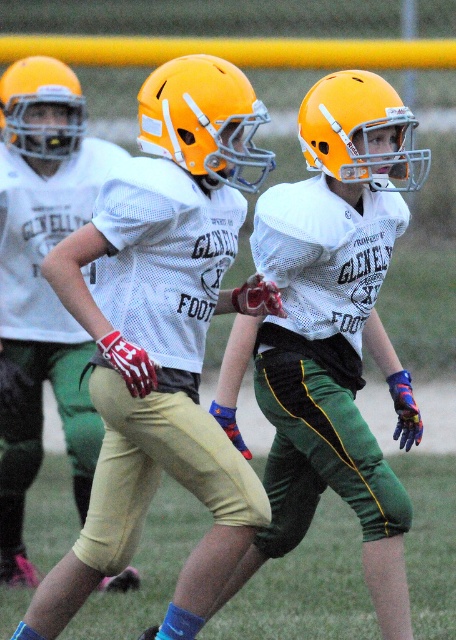
Is point (36, 323) positioned before point (326, 109)?

No, (36, 323) is further to viewer.

The width and height of the screenshot is (456, 640). Find the location of `matte white jersey at center`. matte white jersey at center is located at coordinates (41, 285).

Identify the location of matte white jersey at center. This screenshot has width=456, height=640. (41, 285).

Can you confirm if matte yellow helmet at center is positioned to the left of matte yellow helmet at upper left?

No, matte yellow helmet at center is not to the left of matte yellow helmet at upper left.

Does matte yellow helmet at center come behind matte yellow helmet at upper left?

No, matte yellow helmet at center is in front of matte yellow helmet at upper left.

Looking at this image, who is more distant from viewer, [371,108] or [37,134]?

The point [37,134] is more distant.

Where is `matte yellow helmet at center`? The image size is (456, 640). matte yellow helmet at center is located at coordinates (359, 132).

Does matte white jersey at center appear on the right side of matte yellow helmet at upper left?

Correct, you'll find matte white jersey at center to the right of matte yellow helmet at upper left.

How far apart are matte white jersey at center and matte yellow helmet at upper left?

matte white jersey at center is 15.99 inches away from matte yellow helmet at upper left.

Find the location of `matte white jersey at center`. matte white jersey at center is located at coordinates (41, 285).